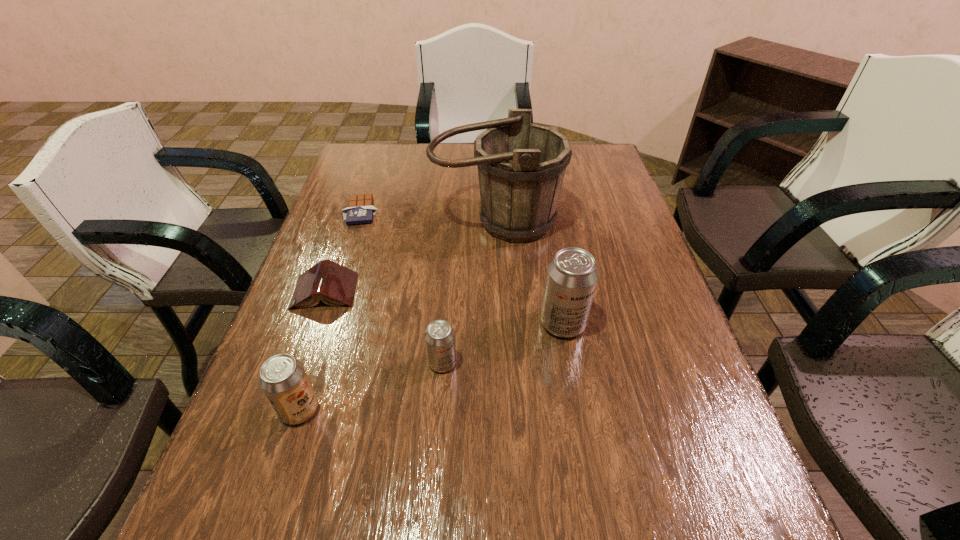
Locate an element on the screen. Image resolution: width=960 pixels, height=540 pixels. free space between the tallest object and the nearest beer can is located at coordinates (397, 315).

This screenshot has height=540, width=960. What are the coordinates of `unoccupied area between the book and the nearest beer can` in the screenshot? It's located at (312, 350).

This screenshot has width=960, height=540. In order to click on free space between the second farthest beer can and the tallest beer can in this screenshot , I will do `click(503, 343)`.

Point out which object is positioned as the nearest to the shortest beer can. Please provide its 2D coordinates. Your answer should be formatted as a tuple, i.e. [(x, y)], where the tuple contains the x and y coordinates of a point satisfying the conditions above.

[(572, 275)]

The height and width of the screenshot is (540, 960). Identify the location of object that is the fifth closest to the third shortest object. (360, 210).

Locate which beer can ranks second in proximity to the fourth tallest object. Please provide its 2D coordinates. Your answer should be formatted as a tuple, i.e. [(x, y)], where the tuple contains the x and y coordinates of a point satisfying the conditions above.

[(283, 379)]

Locate which beer can is the third closest to the shortest object. Please provide its 2D coordinates. Your answer should be formatted as a tuple, i.e. [(x, y)], where the tuple contains the x and y coordinates of a point satisfying the conditions above.

[(283, 379)]

Locate an element on the screen. The width and height of the screenshot is (960, 540). free space that satisfies the following two spatial constraints: 1. on the back side of the second shortest object; 2. on the left side of the chocolate bar is located at coordinates (353, 211).

This screenshot has width=960, height=540. Identify the location of free space that satisfies the following two spatial constraints: 1. on the back side of the second tallest object; 2. on the right side of the nearest object. (327, 323).

The image size is (960, 540). I want to click on vacant space that satisfies the following two spatial constraints: 1. on the handle side of the farthest beer can; 2. on the left side of the bucket, so click(x=500, y=323).